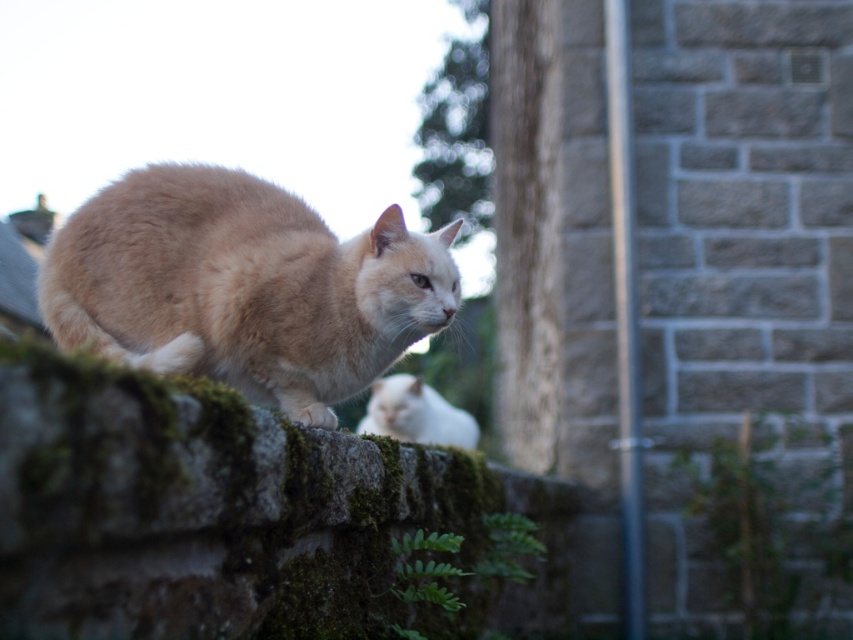
You are standing in front of the stone wall with two cats. There are two points marked on the wall. The first point is at coordinates point (83, 241) and the second point is at point (442, 422). Which of these points is closer to you?

Point (83, 241) is in front of point (442, 422), so it is closer to you.